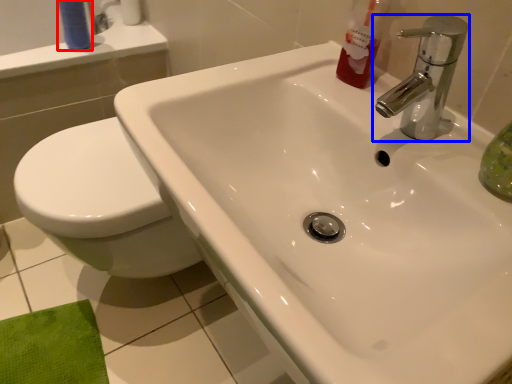
Question: Among these objects, which one is nearest to the camera, toiletry (highlighted by a red box) or tap (highlighted by a blue box)?

Choices:
 (A) toiletry
 (B) tap

Answer: (B)